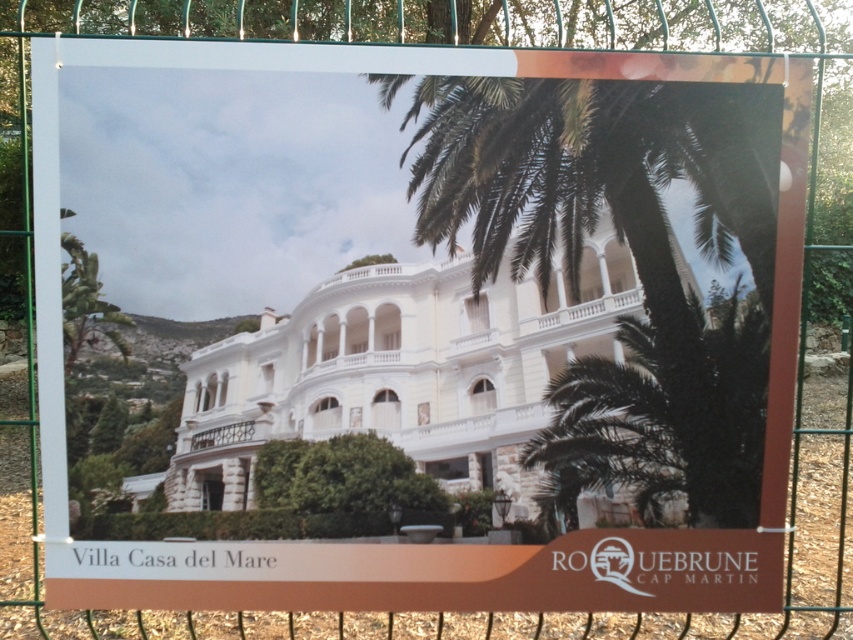
Question: Which point is closer to the camera taking this photo?

Choices:
 (A) (683, 426)
 (B) (560, 468)

Answer: (A)

Question: Does green leafy palm tree at upper right have a larger size compared to green leafy palm tree at center?

Choices:
 (A) no
 (B) yes

Answer: (B)

Question: Does green leafy palm tree at upper right appear under green leafy palm tree at center?

Choices:
 (A) yes
 (B) no

Answer: (B)

Question: Is green leafy palm tree at upper right to the left of green leafy palm tree at center from the viewer's perspective?

Choices:
 (A) yes
 (B) no

Answer: (A)